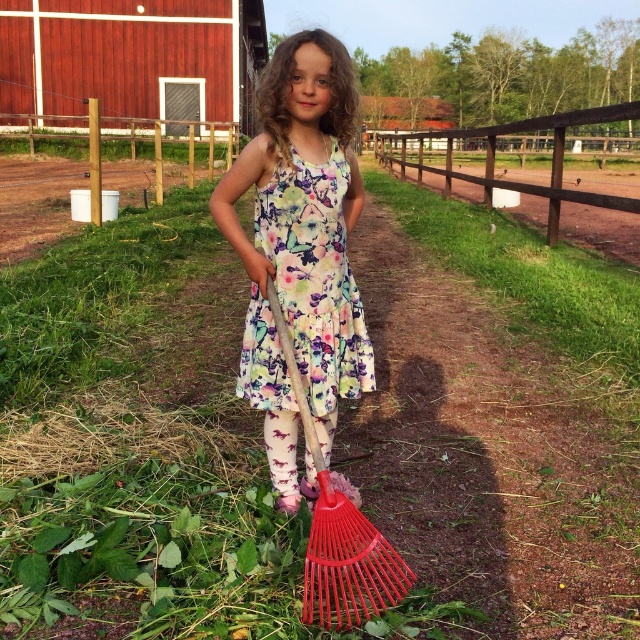
The user is trying to determine if two dresses are the same. They see the floral fabric dress at center and the floral cotton dress at center. Are they the same dress?

The floral fabric dress at center and floral cotton dress at center are 2.38 inches apart from each other, so they are two separate dresses.

You are a photographer trying to capture the girl in the scene. Since you want to ensure the floral cotton dress at center is fully visible in the photo, should you position yourself higher or lower than the brown wooden fence at upper center?

The floral cotton dress at center has a lesser height compared to the brown wooden fence at upper center. To ensure the dress is fully visible, you should position yourself higher than the brown wooden fence at upper center so that the fence doesn not block the view of the dress.